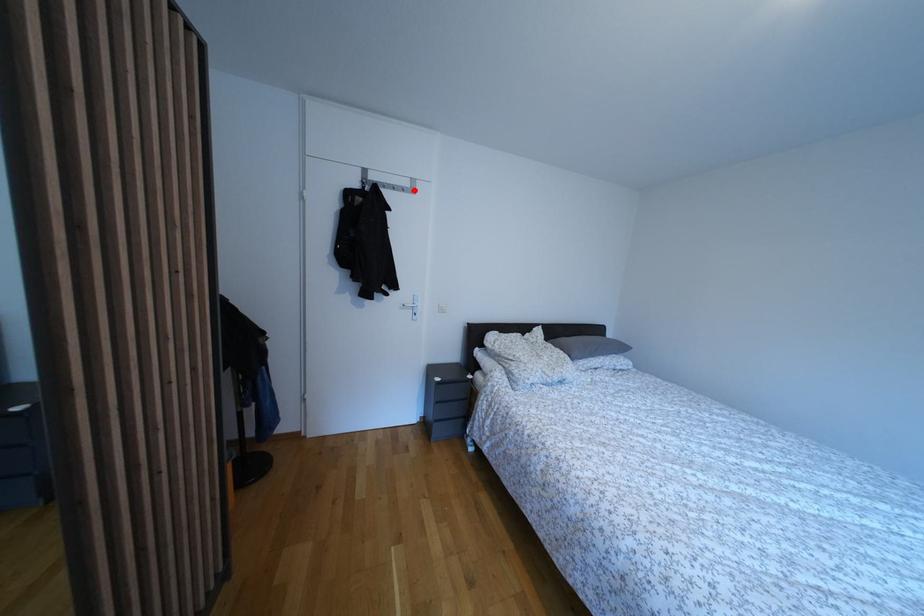
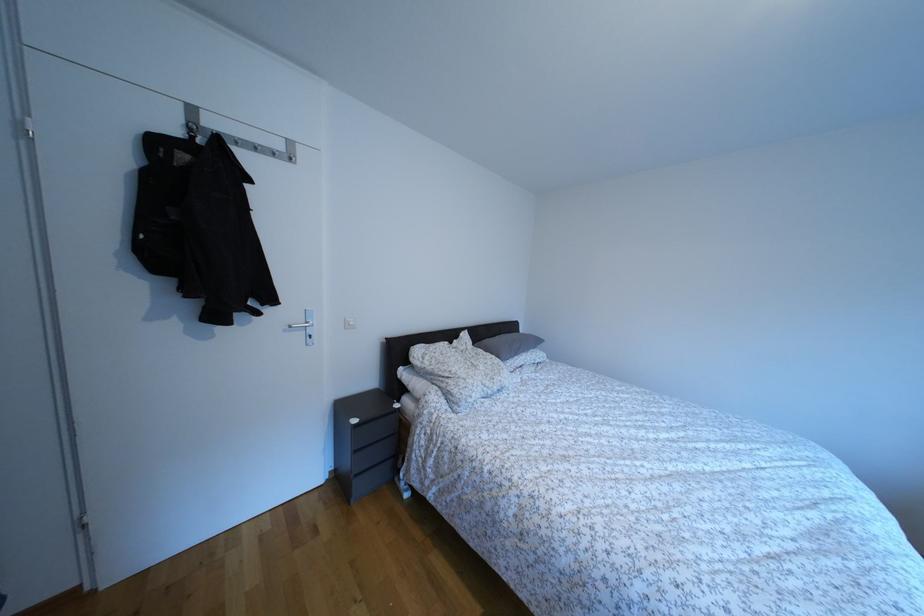
The point at the highlighted location is marked in the first image. Where is the corresponding point in the second image?

(286, 152)